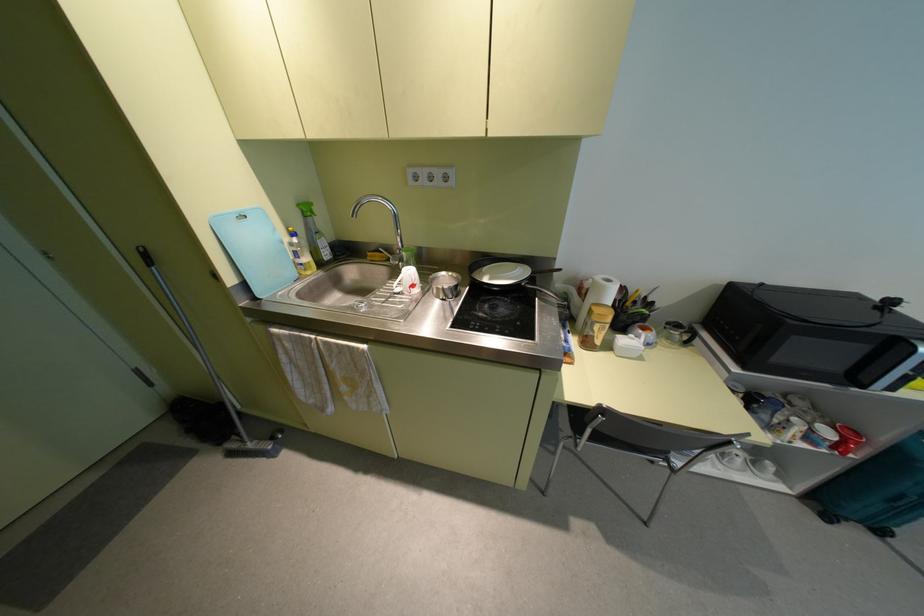
Find where to grasp the frying pan handle. Please return your answer as a coordinate pair (x, y).

(544, 272)